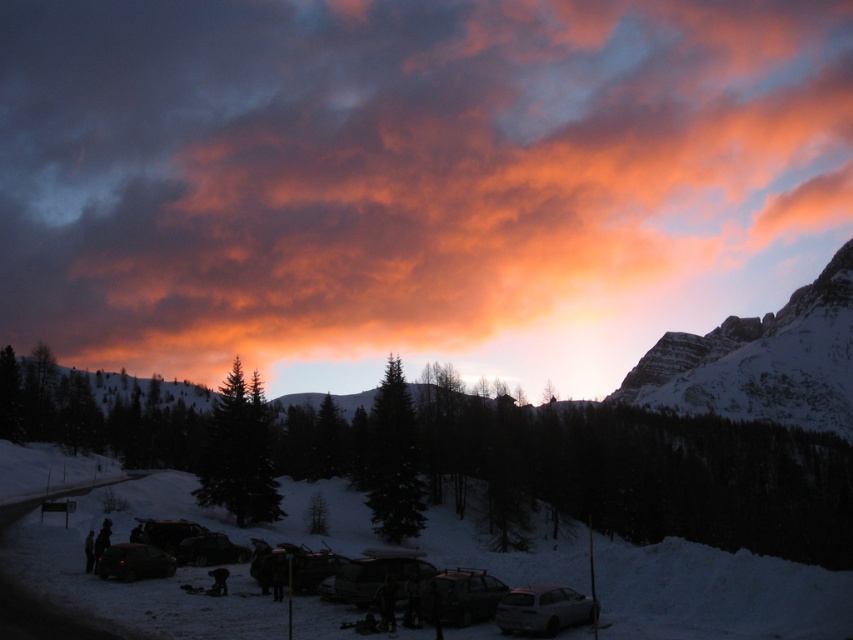
You are an observer standing in the snowy landscape looking at the orange cotton clouds at upper center and the metallic silver car at lower center. Which object is positioned to the left of the other?

The orange cotton clouds at upper center are positioned to the left of the metallic silver car at lower center.

You are an astronomer observing the winter landscape. You notice two points in the sky, one at coordinates point (x=485, y=148) and another at point (x=717, y=637). Based on their positions, which point is closer to the horizon?

Point (x=717, y=637) is closer to the horizon because it has a higher y coordinate than point (x=485, y=148). Since the horizon is at the bottom of the image, the higher y coordinate means it is nearer to the horizon.

You are a photographer wanting to capture both the metallic silver car at lower center and the shiny black car at lower left in a single frame. Based on their positions, which car should you focus on first to ensure both are in the shot?

The metallic silver car at lower center is located below the shiny black car at lower left. To capture both in a single frame, focus on the shiny black car at lower left first, as it is higher up, allowing you to adjust the camera angle downward to include the lower positioned metallic silver car at lower center.